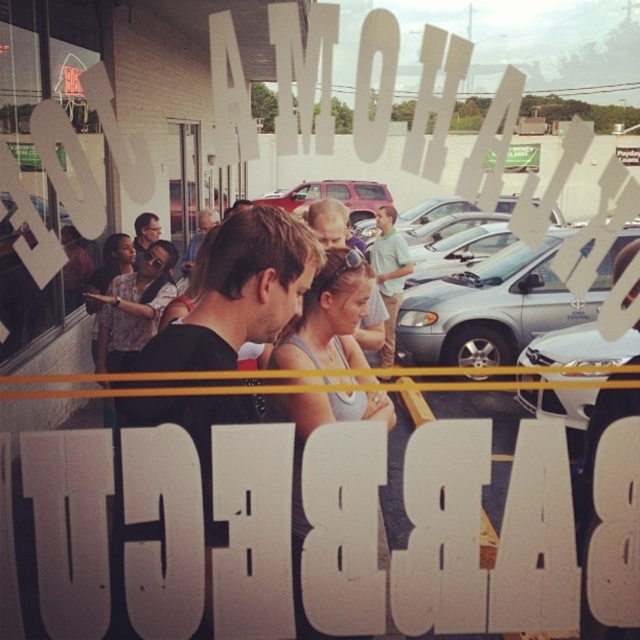
Question: Observing the image, what is the correct spatial positioning of transparent glass window at center in reference to matte gray tank top at center?

Choices:
 (A) above
 (B) below

Answer: (A)

Question: Which point appears closest to the camera in this image?

Choices:
 (A) (298, 627)
 (B) (4, 269)

Answer: (B)

Question: Is transparent glass window at center positioned in front of matte gray tank top at center?

Choices:
 (A) yes
 (B) no

Answer: (A)

Question: Is transparent glass window at center smaller than matte gray tank top at center?

Choices:
 (A) yes
 (B) no

Answer: (A)